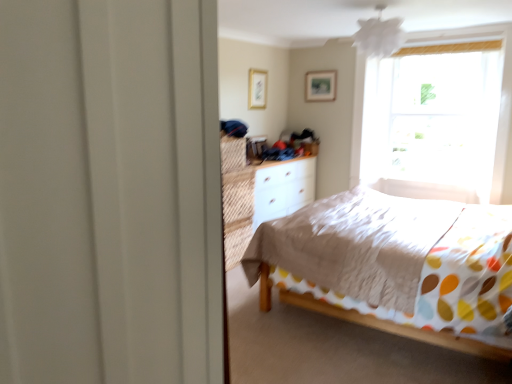
Question: In the image, is white textured bed at center positioned in front of or behind wooden picture frame at upper center, the first picture frame from the right?

Choices:
 (A) behind
 (B) front

Answer: (B)

Question: Is white textured bed at center bigger or smaller than wooden picture frame at upper center, the second picture frame from the left?

Choices:
 (A) small
 (B) big

Answer: (B)

Question: Which of these objects is positioned closest to the wooden picture frame at upper center, the first picture frame from the right?

Choices:
 (A) white textured bed at center
 (B) white matte dresser at center
 (C) wooden picture frame at upper center, which appears as the second picture frame when viewed from the back

Answer: (C)

Question: Based on their relative distances, which object is nearer to the wooden picture frame at upper center, which appears as the second picture frame when viewed from the back?

Choices:
 (A) white matte dresser at center
 (B) wooden picture frame at upper center, the second picture frame positioned from the front
 (C) white textured bed at center

Answer: (B)